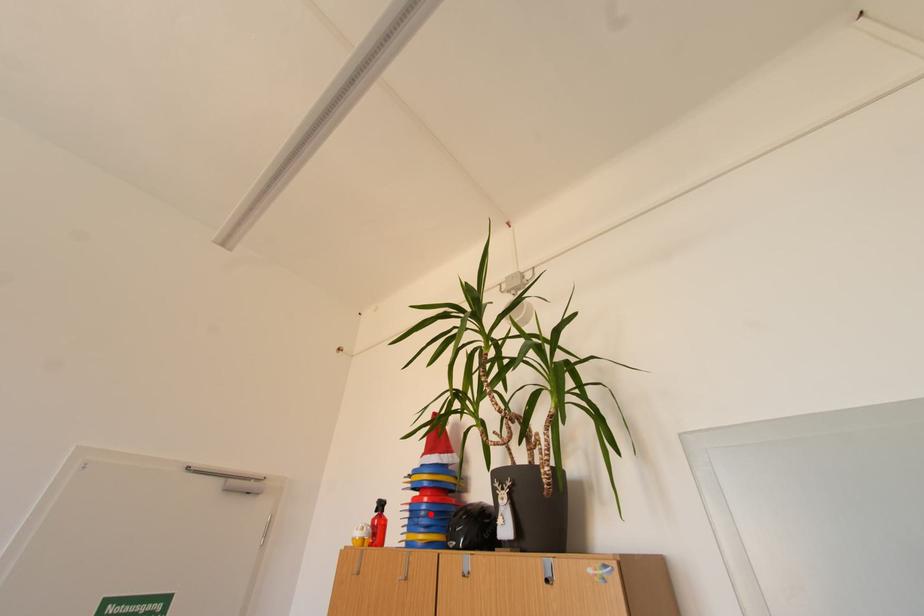
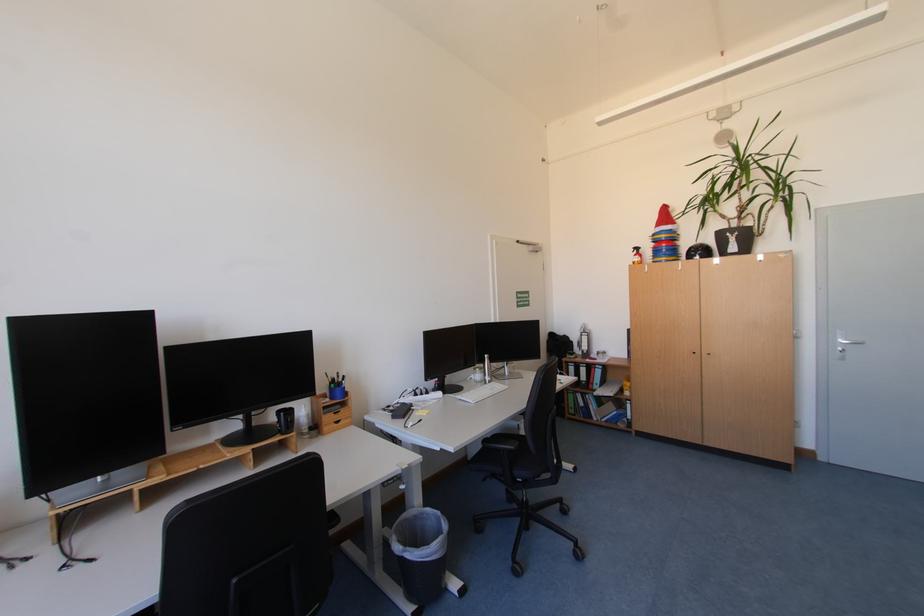
Find the pixel in the second image that matches the highlighted location in the first image.

(672, 252)